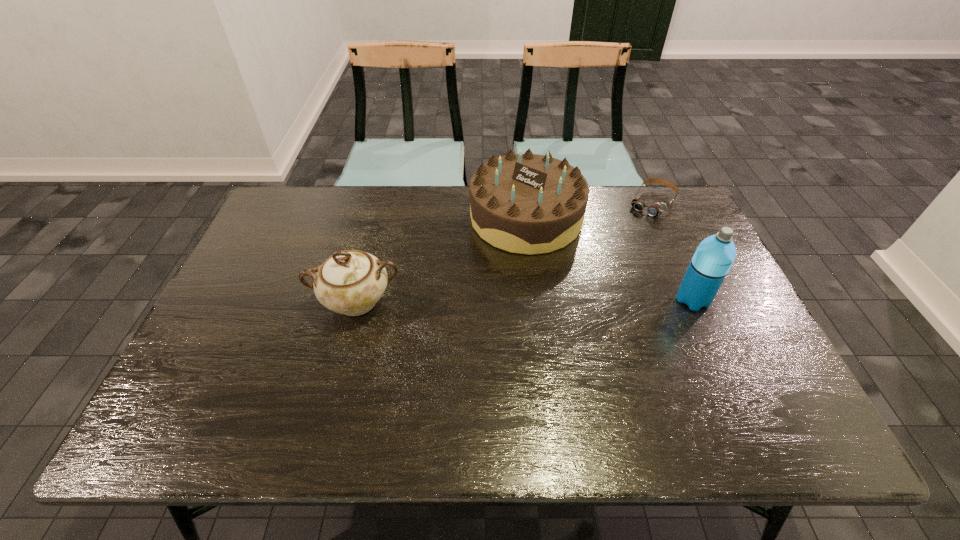
Find the location of a particular element. This screenshot has height=540, width=960. free space on the desktop that is between the leftmost object and the tallest object and is positioned on the front-facing side of the third object from right to left is located at coordinates (489, 301).

This screenshot has height=540, width=960. What are the coordinates of `vacant space on the desktop that is between the leftmost object and the tallest object and is positioned on the front-facing side of the goggles` in the screenshot? It's located at (575, 300).